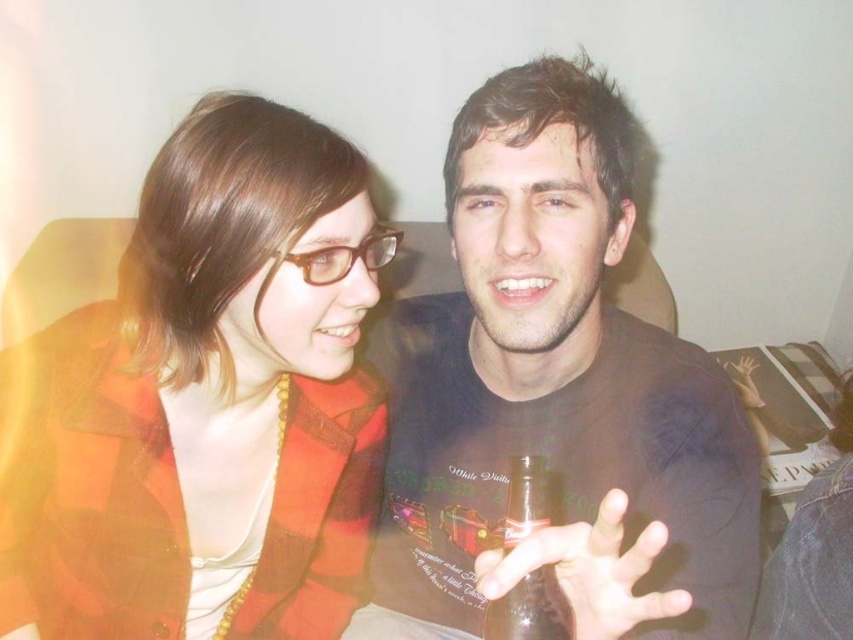
In the scene shown: You are a tailor who needs to determine if the plaid fabric jacket at left can be folded and stored in the translucent glass bottle at center. Based on their sizes, can the jacket fit inside the bottle?

The plaid fabric jacket at left is larger in size than the translucent glass bottle at center, so it cannot fit inside the bottle.